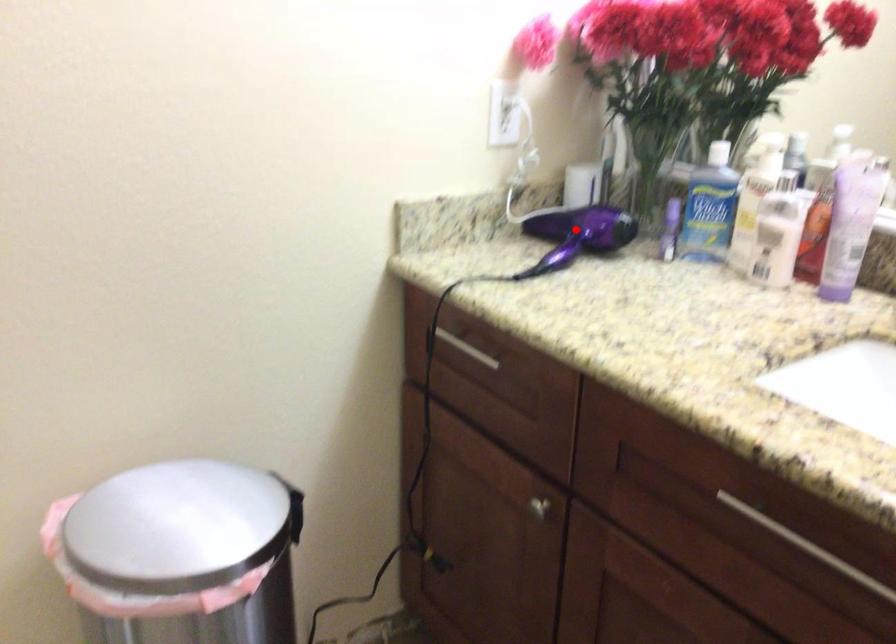
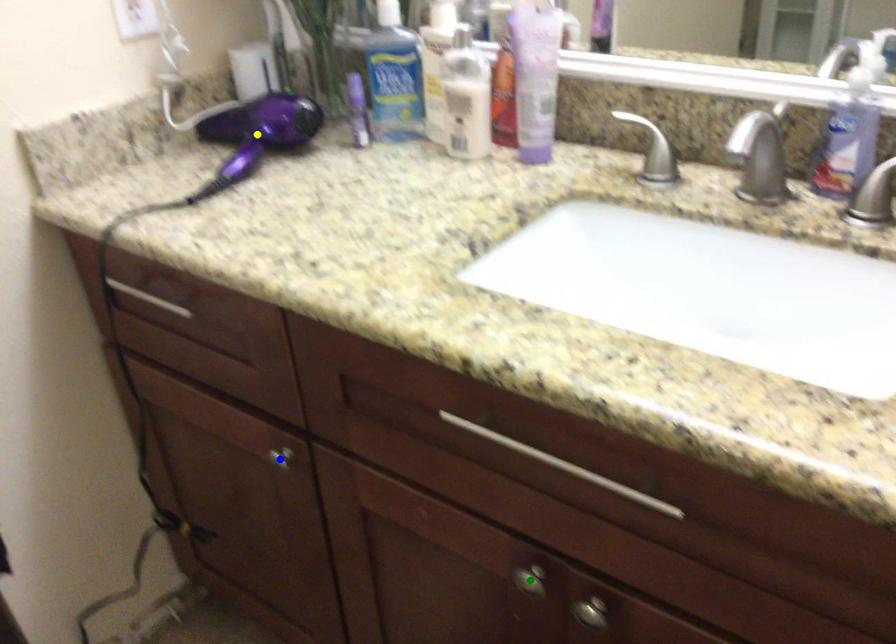
Question: I am providing you with two images of the same scene from different viewpoints. A red point is marked on the first image. You are given multiple points on the second image. Can you choose the point in image 2 that corresponds to the point in image 1?

Choices:
 (A) green point
 (B) blue point
 (C) yellow point

Answer: (C)